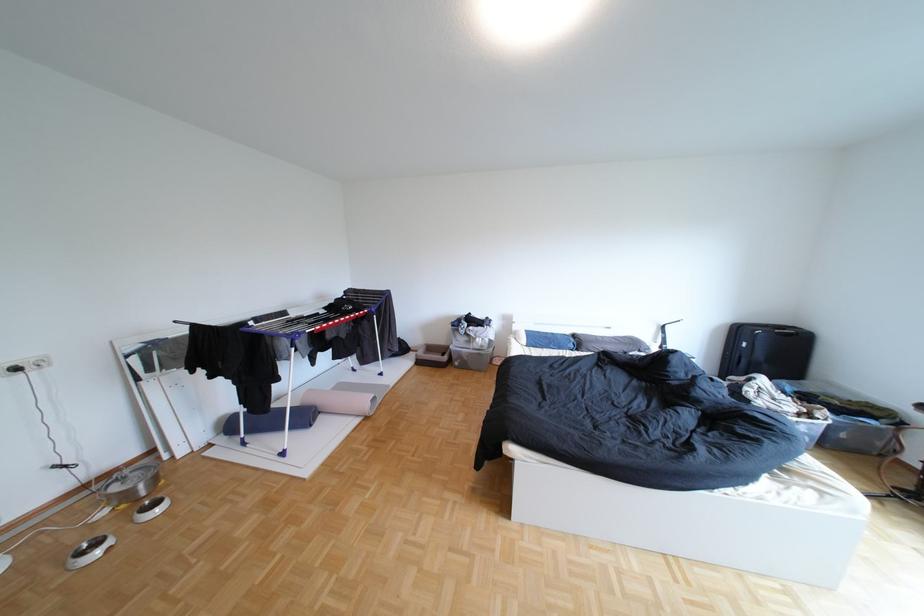
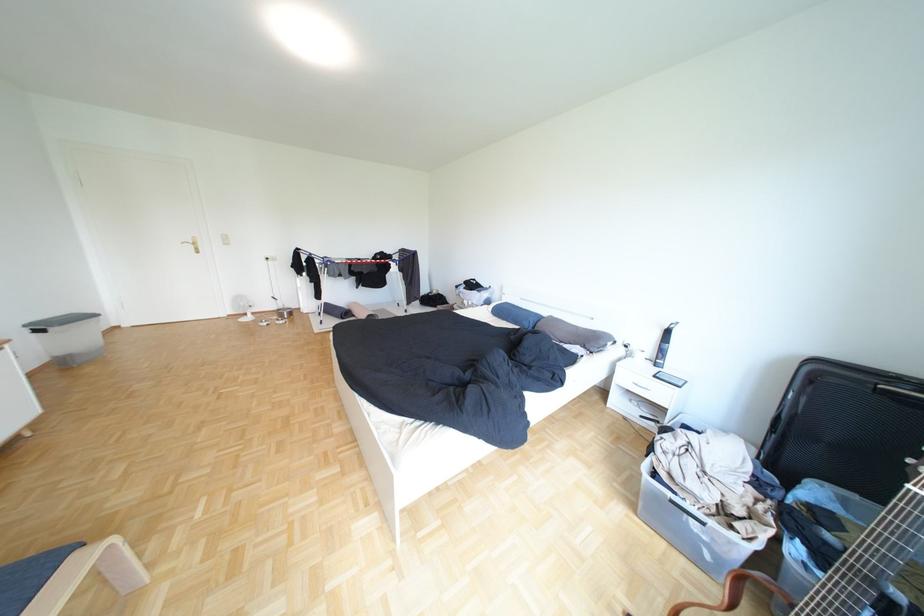
Where in the second image is the point corresponding to (655,351) from the first image?

(600, 347)